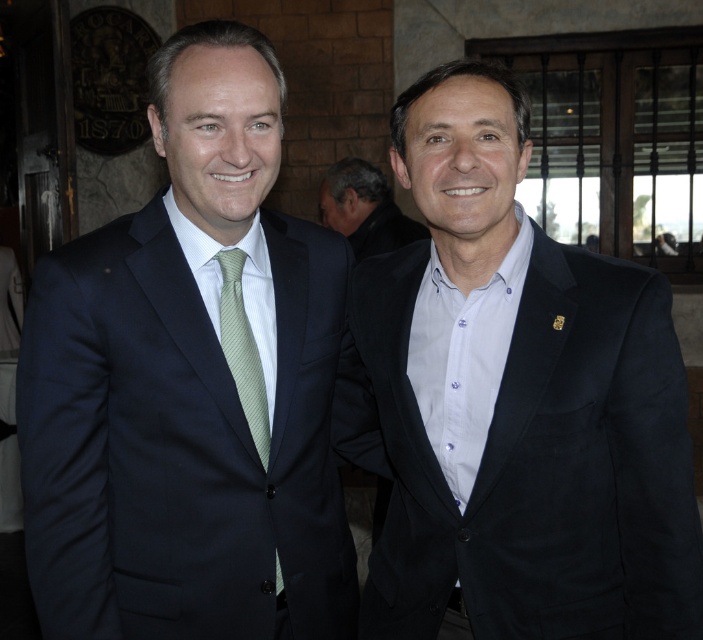
You are a photographer standing at the camera position. You want to take a closeup photo of the matte black suit at left without moving the subject. Can you adjust your camera zoom to focus on it effectively?

The matte black suit at left is 4.43 feet away from camera. Since the distance is relatively short, adjusting the camera zoom to a moderate telephoto setting should allow you to focus effectively on the matte black suit at left without needing to move the subject.

You are a photographer trying to capture a closeup shot of both the matte black suit at left and the green striped tie at center. Given that your camera can only focus on objects within a 30cm width, will both items fit within the frame?

The matte black suit at left is wider than the green striped tie at center. Since the camera can only focus on objects within a 30cm width, the matte black suit at left may exceed the frame, making it difficult to capture both items clearly.

You are a photographer adjusting the lighting for a portrait. You notice the dark brown hair at center and the green striped tie at center. Which object is closer to the camera?

The dark brown hair at center is shorter than the green striped tie at center, so it is closer to the camera.